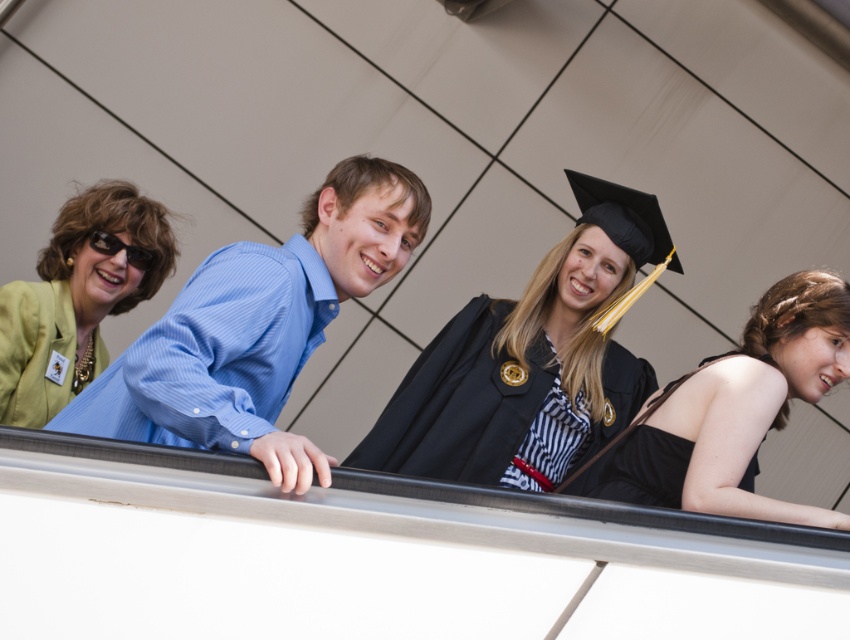
Which is below, matte green robe at upper left or green fabric jacket at left?

matte green robe at upper left is below.

Can you confirm if matte green robe at upper left is wider than green fabric jacket at left?

Indeed, matte green robe at upper left has a greater width compared to green fabric jacket at left.

Does point (167, 330) come in front of point (123, 289)?

Yes, it is in front of point (123, 289).

At what (x,y) coordinates should I click in order to perform the action: click on matte green robe at upper left. Please return your answer as a coordinate pair (x, y). This screenshot has height=640, width=850. Looking at the image, I should click on (214, 353).

From the picture: Does black matte graduation gown at center have a larger size compared to black satin dress at center?

Correct, black matte graduation gown at center is larger in size than black satin dress at center.

Who is taller, black matte graduation gown at center or black satin dress at center?

black matte graduation gown at center is taller.

Is point (517, 381) farther from camera compared to point (836, 376)?

Yes, it is behind point (836, 376).

Locate an element on the screen. This screenshot has width=850, height=640. black matte graduation gown at center is located at coordinates (528, 358).

Is point (171, 440) in front of point (77, 390)?

Yes.

Which is in front, point (275, 296) or point (65, 289)?

Positioned in front is point (275, 296).

Where is `matte green robe at upper left`? matte green robe at upper left is located at coordinates (214, 353).